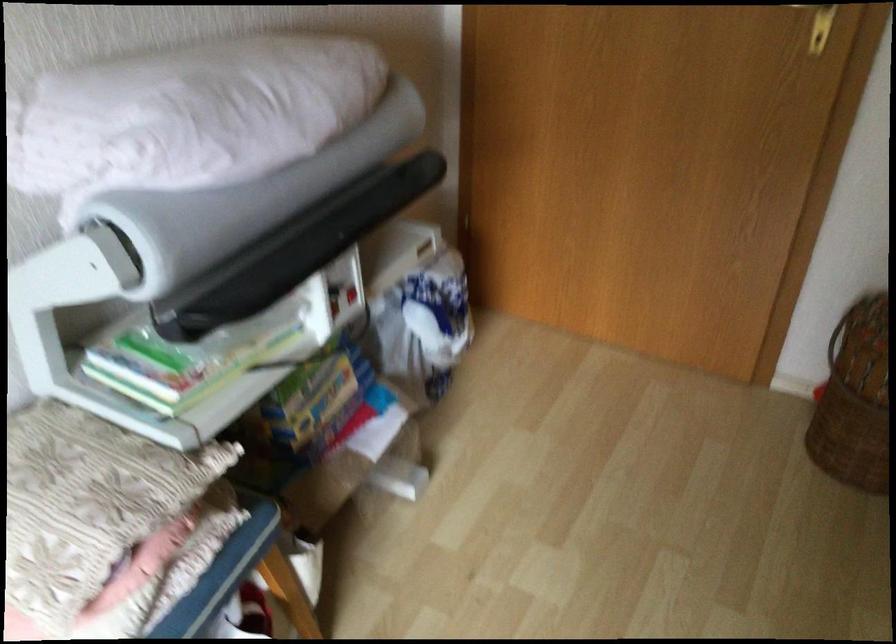
The height and width of the screenshot is (644, 896). Describe the element at coordinates (295, 249) in the screenshot. I see `a black press handle` at that location.